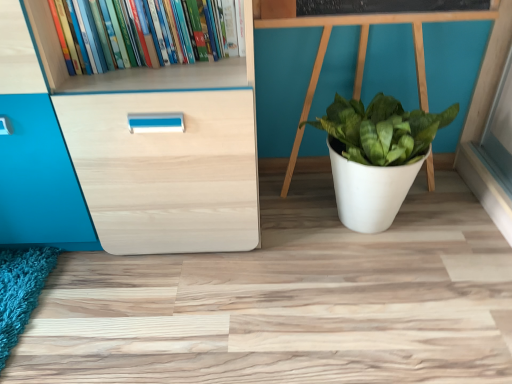
At what (x,y) coordinates should I click in order to perform the action: click on hardcover books at upper left. Please return your answer as a coordinate pair (x, y). This screenshot has height=384, width=512. Looking at the image, I should click on (138, 33).

What do you see at coordinates (138, 33) in the screenshot? I see `hardcover books at upper left` at bounding box center [138, 33].

This screenshot has width=512, height=384. What are the coordinates of `white matte pot at center` in the screenshot? It's located at (376, 156).

The width and height of the screenshot is (512, 384). Describe the element at coordinates (376, 156) in the screenshot. I see `white matte pot at center` at that location.

Identify the location of hardcover books at upper left. This screenshot has height=384, width=512. (138, 33).

Does white matte pot at center appear on the left side of hardcover books at upper left?

No.

Considering the relative positions of white matte pot at center and hardcover books at upper left in the image provided, is white matte pot at center behind hardcover books at upper left?

Yes, the depth of white matte pot at center is greater than that of hardcover books at upper left.

Does point (360, 130) lie behind point (104, 15)?

Yes, point (360, 130) is behind point (104, 15).

From the image's perspective, between white matte pot at center and hardcover books at upper left, who is located below?

white matte pot at center.

From a real-world perspective, is white matte pot at center beneath hardcover books at upper left?

Indeed, from a real-world perspective, white matte pot at center is positioned beneath hardcover books at upper left.

Considering the relative sizes of white matte pot at center and hardcover books at upper left in the image provided, is white matte pot at center thinner than hardcover books at upper left?

No, white matte pot at center is not thinner than hardcover books at upper left.

Which of these two, white matte pot at center or hardcover books at upper left, stands shorter?

hardcover books at upper left.

Which of these two, white matte pot at center or hardcover books at upper left, is smaller?

With smaller size is hardcover books at upper left.

Is white matte pot at center outside of hardcover books at upper left?

Yes, white matte pot at center is located beyond the bounds of hardcover books at upper left.

Is white matte pot at center next to hardcover books at upper left?

white matte pot at center and hardcover books at upper left are clearly separated.

Does white matte pot at center turn towards hardcover books at upper left?

No, white matte pot at center is not oriented towards hardcover books at upper left.

How many degrees apart are the facing directions of white matte pot at center and hardcover books at upper left?

The angular difference between white matte pot at center and hardcover books at upper left is 0.000323 degrees.

Find the location of a particular element. book above the white matte pot at center (from the image's perspective) is located at coordinates (138, 33).

Visually, is hardcover books at upper left positioned to the left or to the right of white matte pot at center?

hardcover books at upper left is to the left of white matte pot at center.

Considering their positions, is hardcover books at upper left located in front of or behind white matte pot at center?

In the image, hardcover books at upper left appears in front of white matte pot at center.

Which is in front, point (66, 36) or point (409, 183)?

Positioned in front is point (66, 36).

From the image's perspective, is hardcover books at upper left on top of white matte pot at center?

Yes.

From a real-world perspective, between hardcover books at upper left and white matte pot at center, who is vertically lower?

white matte pot at center, from a real-world perspective.

Considering the relative sizes of hardcover books at upper left and white matte pot at center in the image provided, is hardcover books at upper left thinner than white matte pot at center?

Indeed, hardcover books at upper left has a lesser width compared to white matte pot at center.

Which of these two, hardcover books at upper left or white matte pot at center, stands shorter?

hardcover books at upper left.

Considering the relative sizes of hardcover books at upper left and white matte pot at center in the image provided, is hardcover books at upper left bigger than white matte pot at center?

No.

Does hardcover books at upper left contain white matte pot at center?

No, white matte pot at center is located outside of hardcover books at upper left.

Is hardcover books at upper left directly adjacent to white matte pot at center?

No, hardcover books at upper left is not beside white matte pot at center.

Is hardcover books at upper left oriented towards white matte pot at center?

No.

At what (x,y) coordinates should I click in order to perform the action: click on book on the left of white matte pot at center. Please return your answer as a coordinate pair (x, y). Looking at the image, I should click on (138, 33).

The width and height of the screenshot is (512, 384). In order to click on book located on the left of white matte pot at center in this screenshot , I will do `click(138, 33)`.

Where is `houseplant that is on the right side of hardcover books at upper left`? The image size is (512, 384). houseplant that is on the right side of hardcover books at upper left is located at coordinates (376, 156).